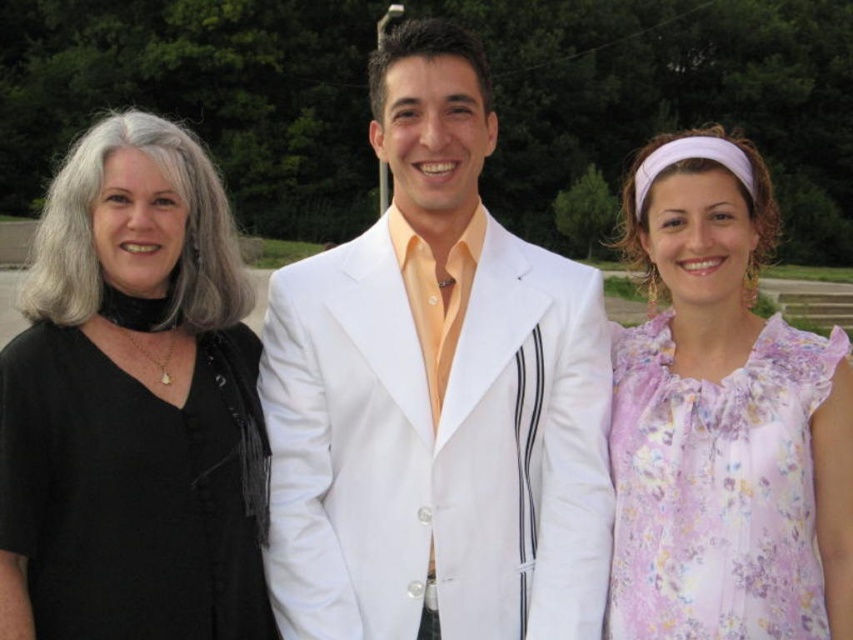
You are a photographer at a fashion show. You need to capture a shot where the floral chiffon blouse at right is visible without being blocked by the white satin suit at center. Is this possible?

The floral chiffon blouse at right is behind the white satin suit at center, so it is currently blocked. To capture the blouse without obstruction, you would need to adjust their positions or angle the camera to avoid the suit blocking the view.

Consider the image. You are a photographer adjusting camera settings. You notice two people in the image wearing the black matte shirt at left and the floral chiffon blouse at right. Which clothing item has a longer length?

The floral chiffon blouse at right has a longer length than the black matte shirt at left.